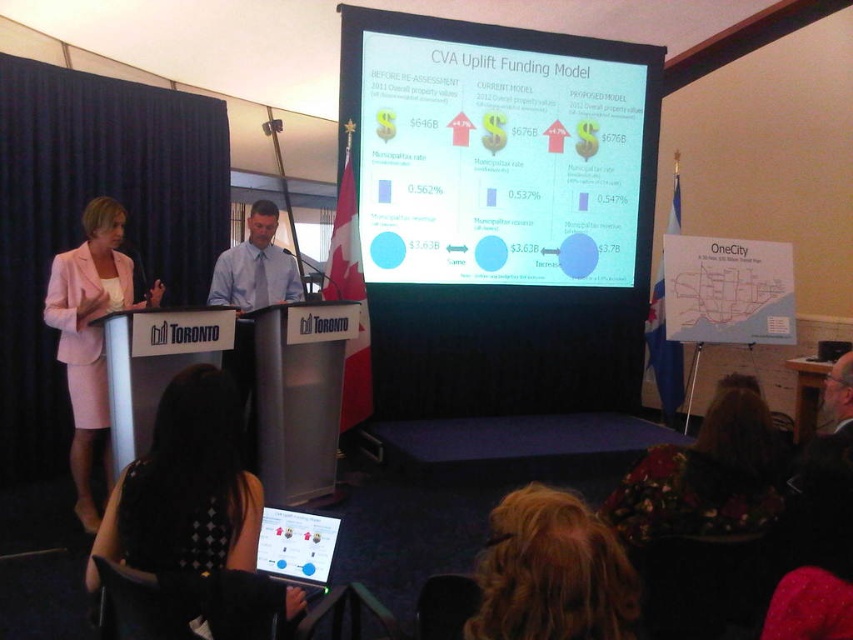
Which is more to the left, blonde hair at lower center or floral fabric dress at lower right?

blonde hair at lower center is more to the left.

Which is in front, point (587, 560) or point (773, 497)?

Positioned in front is point (587, 560).

Find the location of a particular element. blonde hair at lower center is located at coordinates (552, 572).

Can you confirm if black mesh dress at lower center is positioned to the right of matte plastic tablet at lower center?

Incorrect, black mesh dress at lower center is not on the right side of matte plastic tablet at lower center.

What do you see at coordinates (184, 486) in the screenshot? I see `black mesh dress at lower center` at bounding box center [184, 486].

Find the location of a particular element. Image resolution: width=853 pixels, height=640 pixels. black mesh dress at lower center is located at coordinates click(x=184, y=486).

Describe the element at coordinates (254, 266) in the screenshot. I see `blue shirt at center` at that location.

Is point (248, 225) closer to camera compared to point (281, 518)?

No.

The image size is (853, 640). I want to click on blue shirt at center, so click(x=254, y=266).